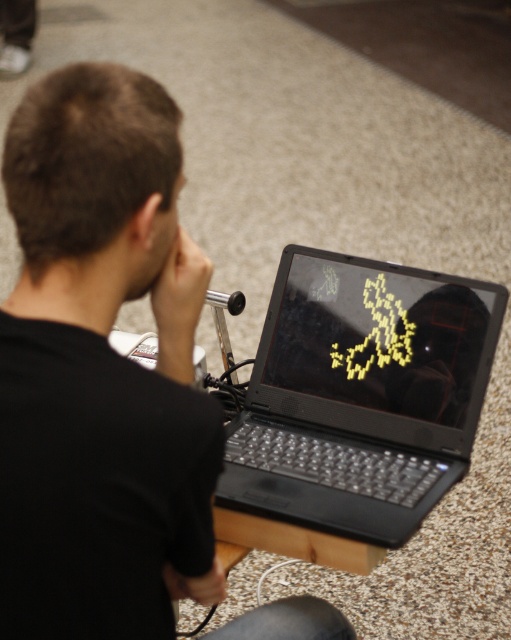
Where is the black matte laptop at center located in the image?

The black matte laptop at center is located at point coordinates of 0.617 on the x axis and 0.706 on the y axis.

You are trying to determine which laptop is on the left side. You see a black matte laptop at center and a black glossy laptop at center. Which one is located to the left?

The black matte laptop at center is positioned on the left side of the black glossy laptop at center.

You are trying to decide which laptop to use for a presentation. You need to choose between the black matte laptop at center and the black glossy laptop at center based on their positions. Which one is closer to you?

The black glossy laptop at center is closer to you because the black matte laptop at center is positioned under it, meaning the glossy one is above and therefore nearer.